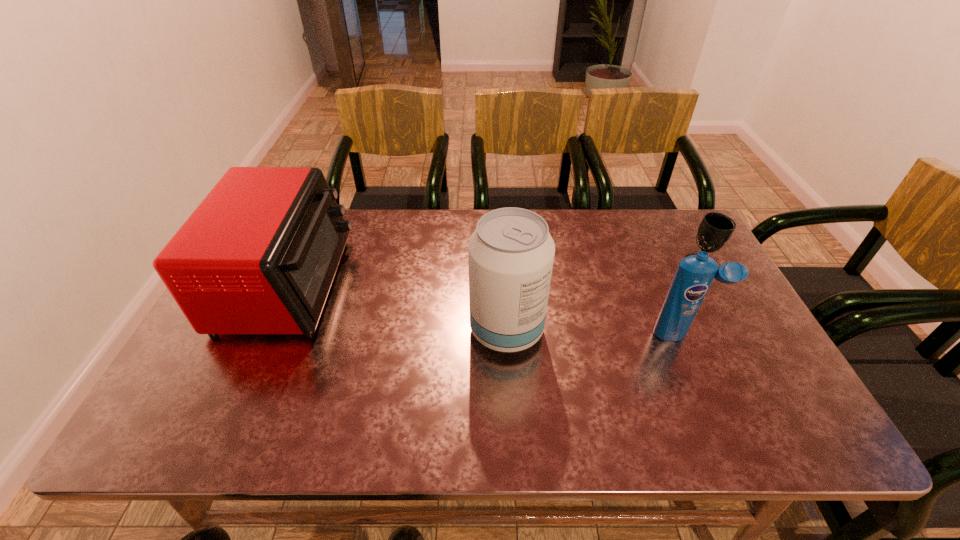
Find the location of a particular element. free space that satisfies the following two spatial constraints: 1. on the front-facing side of the alcohol; 2. on the right side of the leftmost object is located at coordinates (267, 330).

Identify the location of vacant area in the image that satisfies the following two spatial constraints: 1. on the back side of the alcohol; 2. on the right side of the rightmost object. (503, 264).

The width and height of the screenshot is (960, 540). I want to click on free location that satisfies the following two spatial constraints: 1. on the front-facing side of the toaster oven; 2. on the back side of the second object from right to left, so 266,334.

Find the location of `vacant space that satisfies the following two spatial constraints: 1. on the front-facing side of the alcohol; 2. on the left side of the toaster oven`. vacant space that satisfies the following two spatial constraints: 1. on the front-facing side of the alcohol; 2. on the left side of the toaster oven is located at coordinates (267, 330).